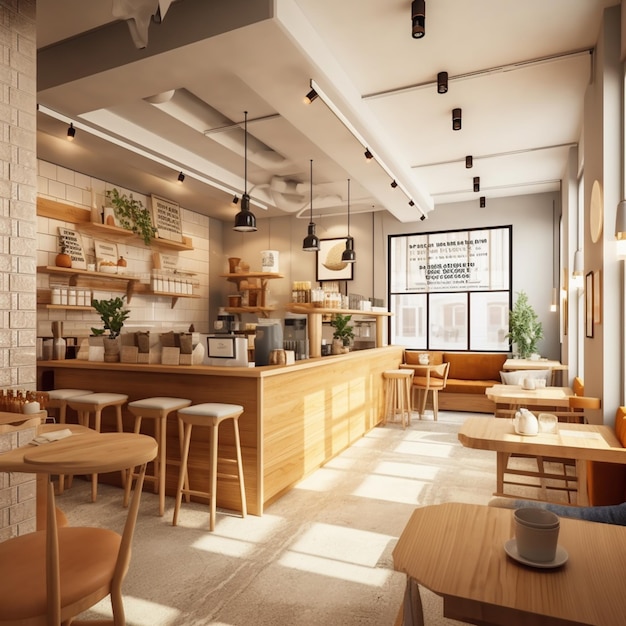
What are the coordinates of `stool` in the screenshot? It's located at (210, 413), (161, 404), (93, 398), (67, 394), (389, 374).